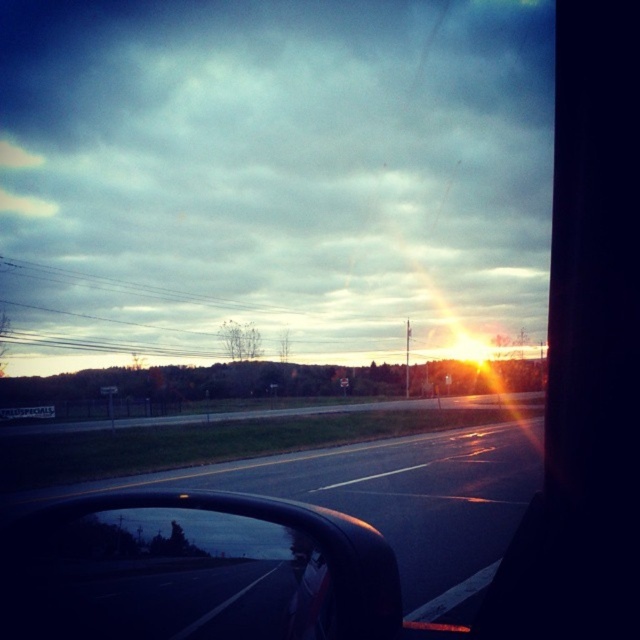
Question: Is black asphalt highway at center to the right of black glossy rearview mirror at lower left from the viewer's perspective?

Choices:
 (A) no
 (B) yes

Answer: (B)

Question: Which of the following is the farthest from the observer?

Choices:
 (A) black glossy rearview mirror at lower left
 (B) black asphalt highway at center

Answer: (B)

Question: Is black asphalt highway at center positioned behind black glossy rearview mirror at lower left?

Choices:
 (A) yes
 (B) no

Answer: (A)

Question: Among these objects, which one is nearest to the camera?

Choices:
 (A) black glossy rearview mirror at lower left
 (B) black asphalt highway at center

Answer: (A)

Question: Which point is farther to the camera?

Choices:
 (A) (77, 612)
 (B) (257, 502)

Answer: (B)

Question: Considering the relative positions of black asphalt highway at center and black glossy rearview mirror at lower left in the image provided, where is black asphalt highway at center located with respect to black glossy rearview mirror at lower left?

Choices:
 (A) below
 (B) above

Answer: (A)